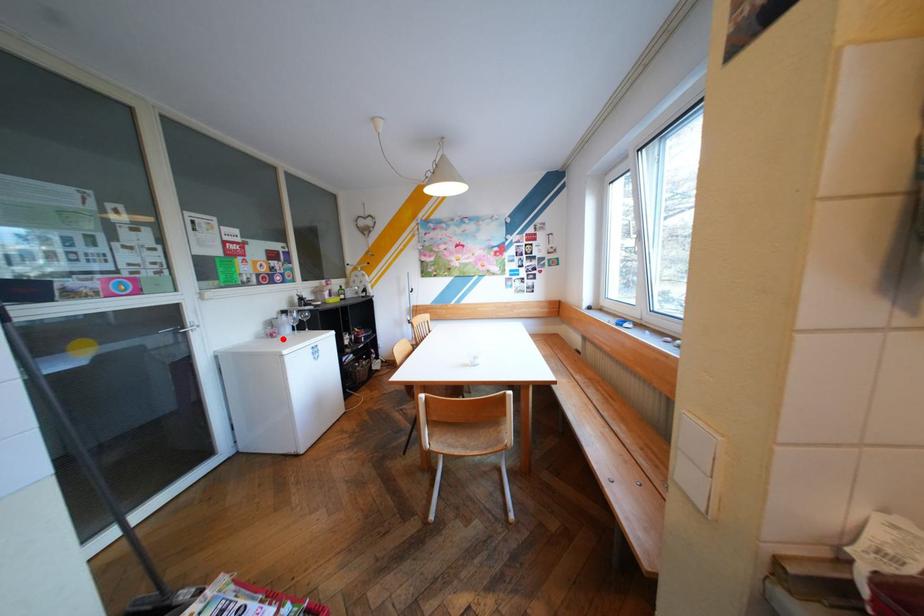
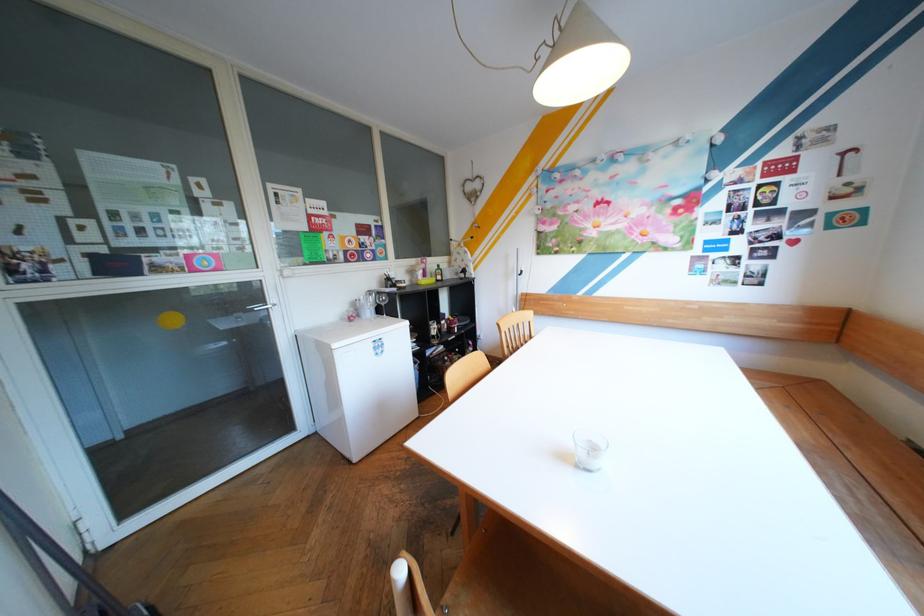
Where in the second image is the point corresponding to the highlighted location from the first image?

(360, 322)